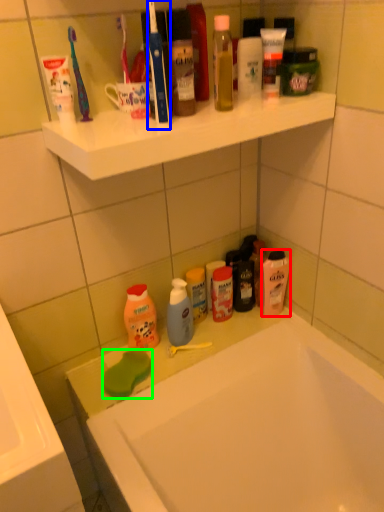
Question: Estimate the real-world distances between objects in this image. Which object is closer to mouthwash (highlighted by a red box), toothbrush (highlighted by a blue box) or soap (highlighted by a green box)?

Choices:
 (A) toothbrush
 (B) soap

Answer: (B)